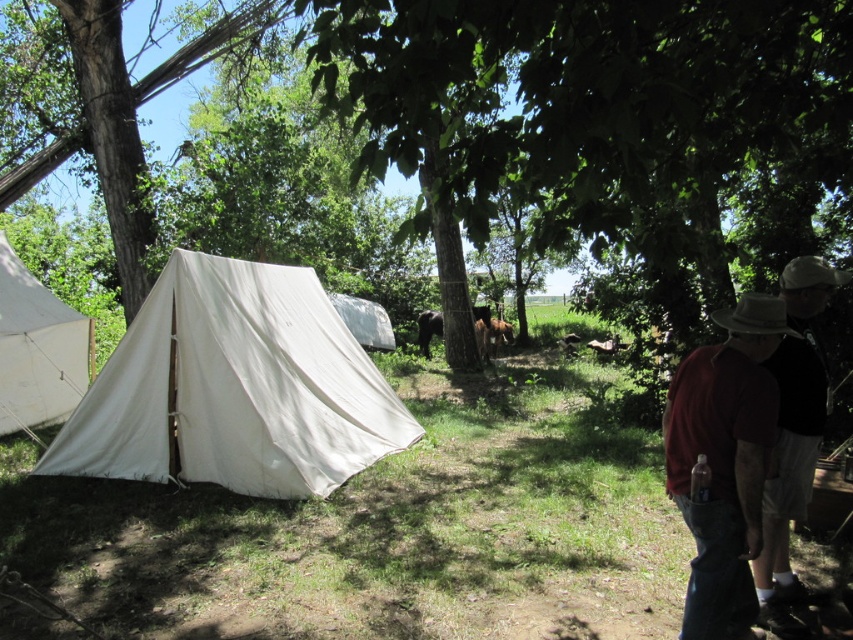
Does brown canvas hat at right have a greater height compared to brown furry dog at center?

Indeed, brown canvas hat at right has a greater height compared to brown furry dog at center.

Looking at this image, does brown canvas hat at right have a lesser height compared to brown furry dog at center?

Incorrect, brown canvas hat at right's height does not fall short of brown furry dog at center's.

Image resolution: width=853 pixels, height=640 pixels. What are the coordinates of `brown canvas hat at right` in the screenshot? It's located at (791, 458).

Find the location of a particular element. white canvas tent at left is located at coordinates (x=234, y=388).

Find the location of a particular element. The width and height of the screenshot is (853, 640). white canvas tent at left is located at coordinates (234, 388).

Who is shorter, white canvas tent at center or brown furry dog at center?

brown furry dog at center is shorter.

I want to click on white canvas tent at center, so click(364, 321).

Where is `white canvas tent at center`? This screenshot has width=853, height=640. white canvas tent at center is located at coordinates (364, 321).